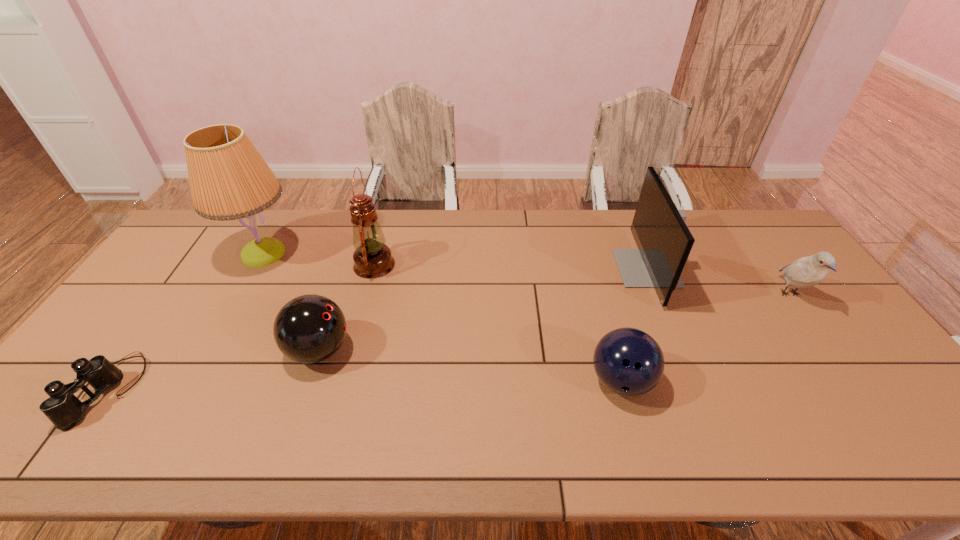
The height and width of the screenshot is (540, 960). In order to click on computer monitor that is at the far edge in this screenshot , I will do [664, 241].

This screenshot has height=540, width=960. Identify the location of object that is at the near edge. (62, 408).

Identify the location of object that is at the left edge. (62, 408).

Where is `object at the right edge`? The height and width of the screenshot is (540, 960). object at the right edge is located at coordinates (x=805, y=272).

This screenshot has width=960, height=540. What are the coordinates of `object situated at the near left corner` in the screenshot? It's located at (62, 408).

The width and height of the screenshot is (960, 540). I want to click on vacant space at the far edge of the desktop, so click(339, 222).

In the image, there is a desktop. Find the location of `free space at the near edge`. free space at the near edge is located at coordinates (460, 447).

I want to click on free space at the left edge of the desktop, so click(103, 409).

Image resolution: width=960 pixels, height=540 pixels. I want to click on free space at the right edge of the desktop, so point(879,423).

The height and width of the screenshot is (540, 960). I want to click on free location at the far left corner, so click(191, 230).